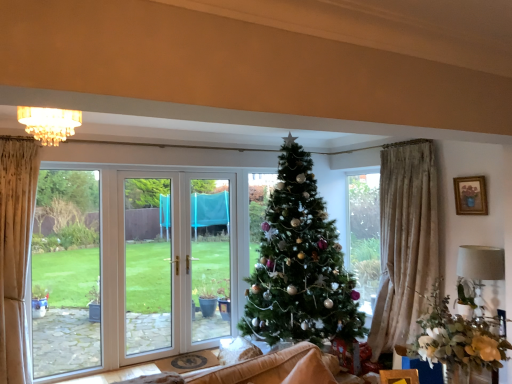
Question: Is wooden framed picture at upper right inside the boundaries of crystal chandelier at upper center, or outside?

Choices:
 (A) outside
 (B) inside

Answer: (A)

Question: In terms of height, does wooden framed picture at upper right look taller or shorter compared to crystal chandelier at upper center?

Choices:
 (A) tall
 (B) short

Answer: (A)

Question: Considering the real-world distances, which object is farthest from the green matte christmas tree at center?

Choices:
 (A) wooden box at lower right
 (B) white fabric lampshade at right
 (C) crystal chandelier at upper center
 (D) wooden framed picture at upper right

Answer: (C)

Question: Based on their relative distances, which object is nearer to the wooden box at lower right?

Choices:
 (A) green matte christmas tree at center
 (B) crystal chandelier at upper center
 (C) wooden framed picture at upper right
 (D) white fabric lampshade at right

Answer: (D)